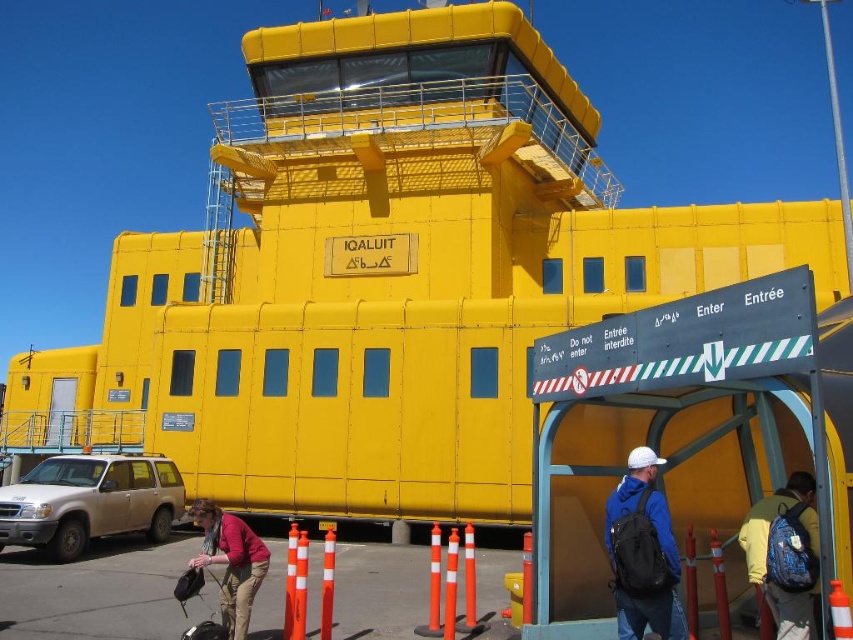
Who is shorter, blue backpack at lower right or matte pink sweater at lower left?

Standing shorter between the two is blue backpack at lower right.

Is blue backpack at lower right thinner than matte pink sweater at lower left?

Yes, blue backpack at lower right is thinner than matte pink sweater at lower left.

Find the location of a particular element. The height and width of the screenshot is (640, 853). blue backpack at lower right is located at coordinates (769, 554).

At what (x,y) coordinates should I click in order to perform the action: click on blue backpack at lower right. Please return your answer as a coordinate pair (x, y). The width and height of the screenshot is (853, 640). Looking at the image, I should click on (769, 554).

Does silver metallic suv at lower left appear under matte pink sweater at lower left?

Actually, silver metallic suv at lower left is above matte pink sweater at lower left.

Describe the element at coordinates (90, 500) in the screenshot. The image size is (853, 640). I see `silver metallic suv at lower left` at that location.

Locate an element on the screen. This screenshot has width=853, height=640. silver metallic suv at lower left is located at coordinates (90, 500).

Who is lower down, silver metallic suv at lower left or blue fabric backpack at center?

Positioned lower is silver metallic suv at lower left.

Find the location of a particular element. This screenshot has height=640, width=853. silver metallic suv at lower left is located at coordinates (90, 500).

Locate an element on the screen. silver metallic suv at lower left is located at coordinates (90, 500).